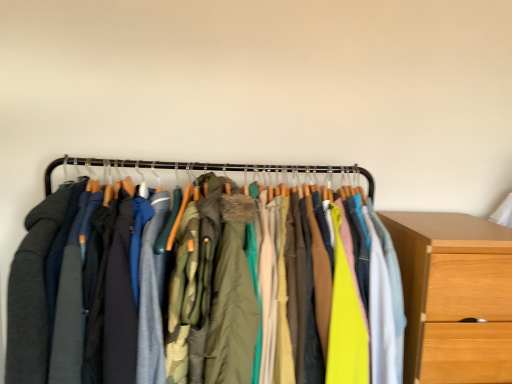
Question: Considering the relative sizes of green textured coat at center and textured fabric jackets at center in the image provided, is green textured coat at center thinner than textured fabric jackets at center?

Choices:
 (A) yes
 (B) no

Answer: (B)

Question: Could you tell me if green textured coat at center is facing textured fabric jackets at center?

Choices:
 (A) yes
 (B) no

Answer: (A)

Question: Does green textured coat at center have a greater width compared to textured fabric jackets at center?

Choices:
 (A) no
 (B) yes

Answer: (B)

Question: Is green textured coat at center completely or partially outside of textured fabric jackets at center?

Choices:
 (A) no
 (B) yes

Answer: (A)

Question: Is green textured coat at center far away from textured fabric jackets at center?

Choices:
 (A) yes
 (B) no

Answer: (B)

Question: Is textured fabric jackets at center a part of green textured coat at center?

Choices:
 (A) no
 (B) yes

Answer: (A)

Question: Would you say textured fabric jackets at center is outside green textured coat at center?

Choices:
 (A) no
 (B) yes

Answer: (B)

Question: Could you tell me if textured fabric jackets at center is facing green textured coat at center?

Choices:
 (A) no
 (B) yes

Answer: (B)

Question: Does textured fabric jackets at center have a larger size compared to green textured coat at center?

Choices:
 (A) no
 (B) yes

Answer: (B)

Question: Considering the relative sizes of textured fabric jackets at center and green textured coat at center in the image provided, is textured fabric jackets at center wider than green textured coat at center?

Choices:
 (A) yes
 (B) no

Answer: (B)

Question: Does textured fabric jackets at center have a lesser height compared to green textured coat at center?

Choices:
 (A) no
 (B) yes

Answer: (B)

Question: From a real-world perspective, is textured fabric jackets at center positioned over green textured coat at center based on gravity?

Choices:
 (A) no
 (B) yes

Answer: (B)

Question: Considering the relative sizes of wooden chest of drawers at right and textured fabric jackets at center in the image provided, is wooden chest of drawers at right smaller than textured fabric jackets at center?

Choices:
 (A) yes
 (B) no

Answer: (A)